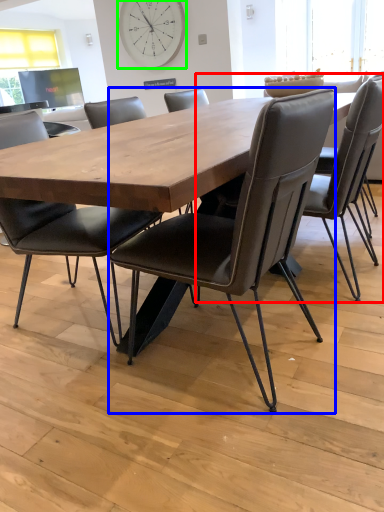
Question: Estimate the real-world distances between objects in this image. Which object is closer to chair (highlighted by a red box), chair (highlighted by a blue box) or clock (highlighted by a green box)?

Choices:
 (A) chair
 (B) clock

Answer: (A)